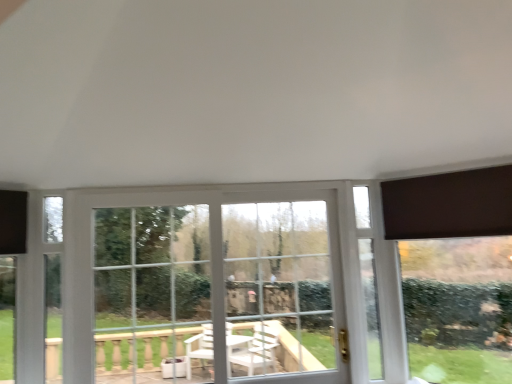
Question: Is point (450, 180) positioned closer to the camera than point (318, 264)?

Choices:
 (A) farther
 (B) closer

Answer: (B)

Question: From a real-world perspective, relative to clear glass bay window at center, is dark brown fabric at upper right vertically above or below?

Choices:
 (A) above
 (B) below

Answer: (A)

Question: Which of these objects is positioned closest to the white plastic window at center?

Choices:
 (A) clear glass bay window at center
 (B) dark brown fabric at upper right

Answer: (A)

Question: Which object is positioned farthest from the dark brown fabric at upper right?

Choices:
 (A) white plastic window at center
 (B) clear glass bay window at center

Answer: (B)